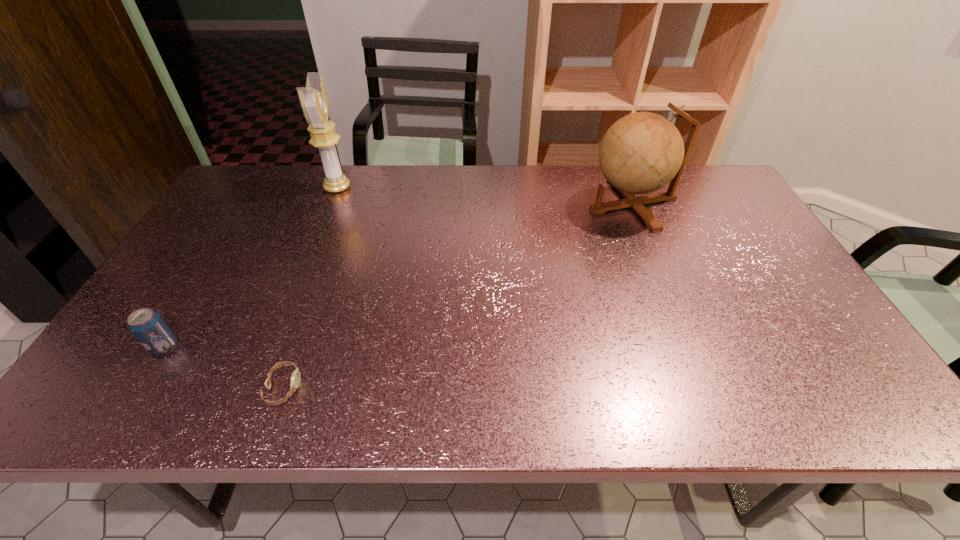
Where is `the second closest object to the third farthest object`? The image size is (960, 540). the second closest object to the third farthest object is located at coordinates (313, 98).

I want to click on the third closest object to the shortest object, so 641,153.

You are a GUI agent. You are given a task and a screenshot of the screen. Output one action in this format:
    pyautogui.click(x=<x>, y=<y>)
    Task: Click on the free space that satisfies the following two spatial constraints: 1. on the surface of the globe; 2. on the front side of the pop soda
    The image size is (960, 540).
    Given the screenshot: What is the action you would take?
    pyautogui.click(x=692, y=346)